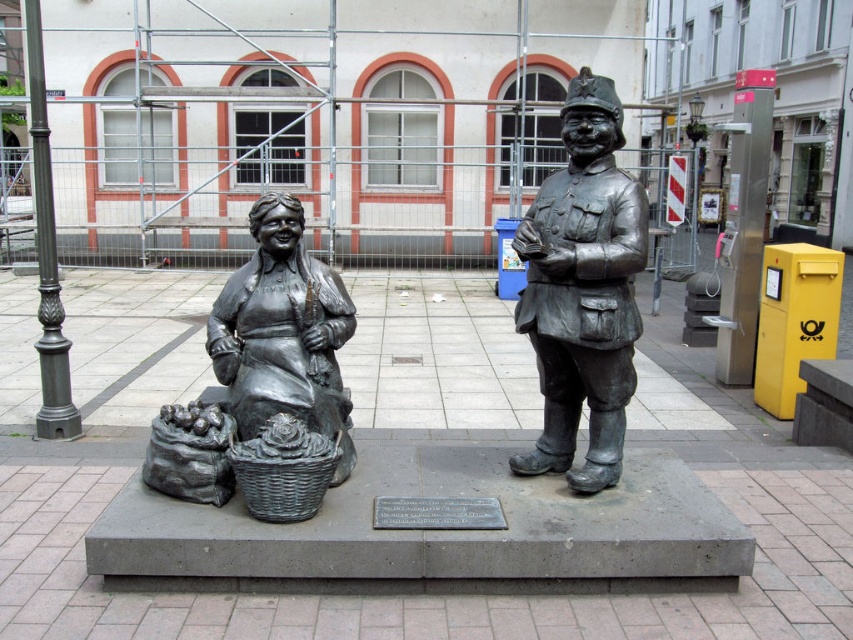
Question: Is bronze statue at center closer to the viewer compared to bronze statue at left?

Choices:
 (A) yes
 (B) no

Answer: (A)

Question: Can you confirm if bronze statue at center is smaller than bronze statue at left?

Choices:
 (A) yes
 (B) no

Answer: (B)

Question: Among these objects, which one is farthest from the camera?

Choices:
 (A) bronze statue at center
 (B) bronze statue at left

Answer: (B)

Question: Does bronze statue at left have a lesser width compared to rustic wicker basket at lower center?

Choices:
 (A) yes
 (B) no

Answer: (B)

Question: Which is farther from the rustic wicker basket at lower center?

Choices:
 (A) bronze statue at center
 (B) bronze statue at left

Answer: (A)

Question: Which object appears farthest from the camera in this image?

Choices:
 (A) rustic wicker basket at lower center
 (B) bronze statue at left

Answer: (B)